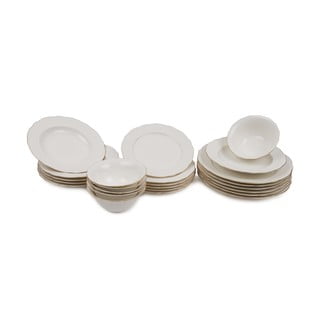
At what (x,y) coordinates should I click in order to perform the action: click on dishes in third stack from the left. Please return your answer as a coordinate pair (x, y). Looking at the image, I should click on (166, 164), (176, 178), (172, 184), (170, 187), (166, 190), (171, 191).